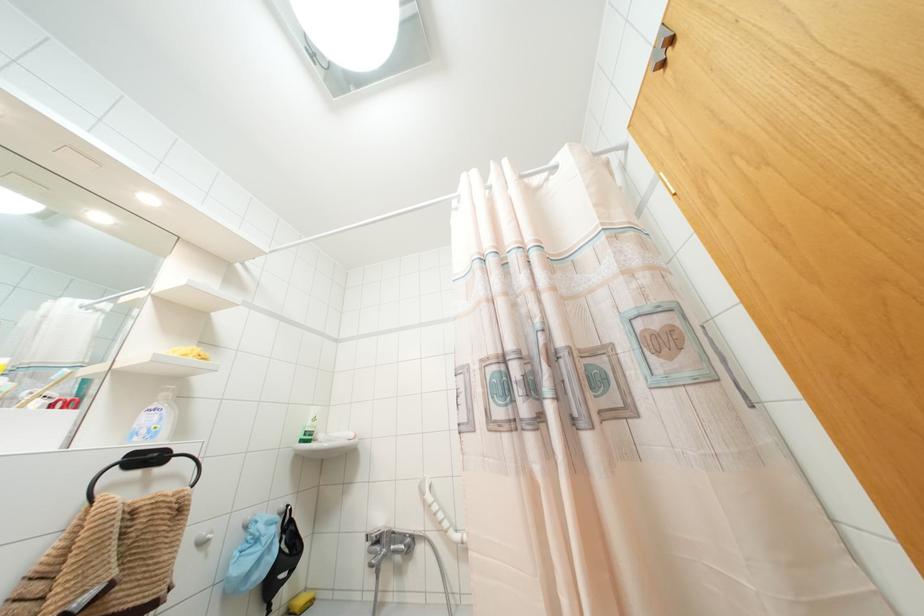
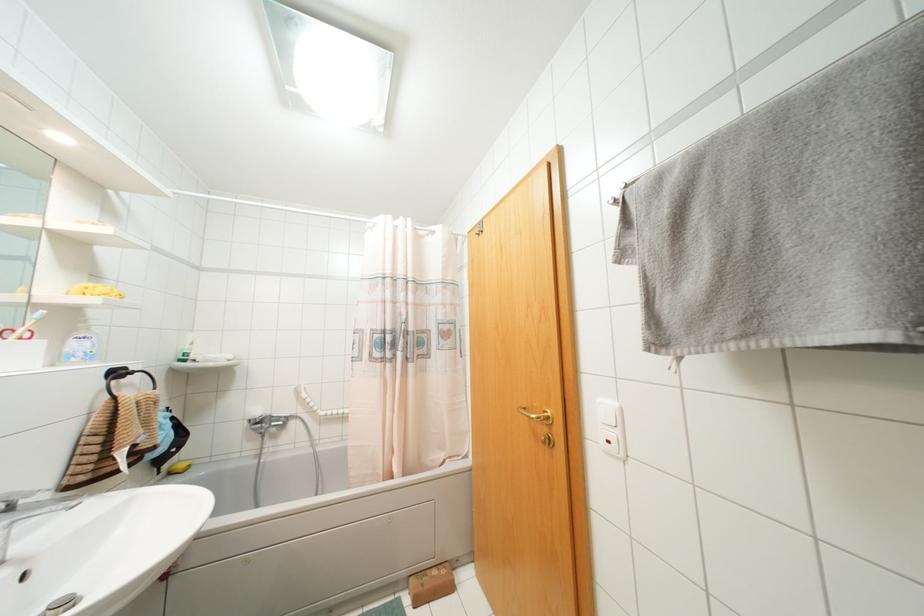
Where in the second image is the point corresponding to point 312,419 from the first image?

(190, 342)